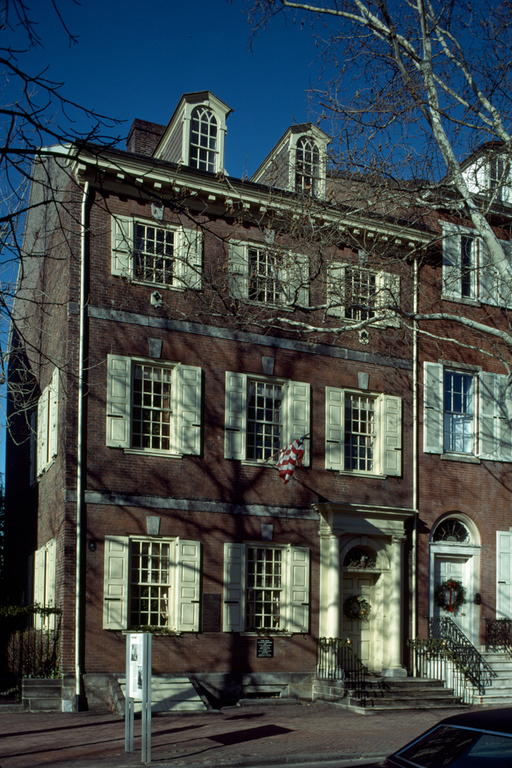
At what (x,y) coordinates should I click in order to perform the action: click on semi circle windows. Please return your answer as a coordinate pair (x, y). Looking at the image, I should click on (454, 540), (370, 561).